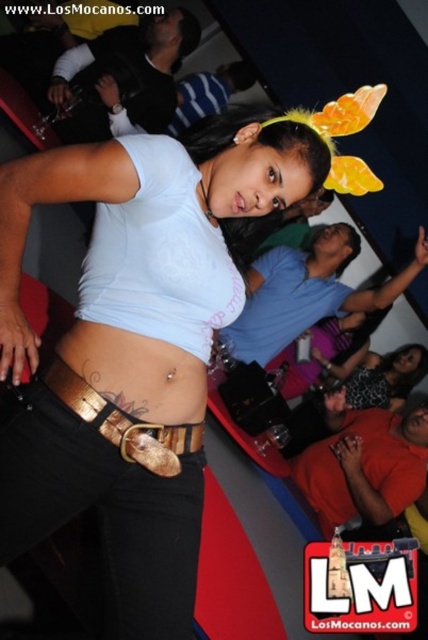
You are a photographer at the event and want to capture a shot focusing on the matte white tank top at center and the matte black top at center. Which one is positioned to the left side of the other?

The matte white tank top at center is to the left of the matte black top at center.

You are organizing a charity event and need to display two shirts, the matte white tank top at center and the matte black top at center, on a single mannequin. The mannequin can only accommodate one shirt at a time. Based on the image, which shirt would you choose to showcase first if you want to highlight the widest option?

The matte white tank top at center might be wider than the matte black top at center, so it should be showcased first to highlight its width.

You are a fashion designer observing this scene and want to create a new outfit that incorporates both the matte white tank top at center and the gold metallic belt at lower center. Based on their sizes, can the belt be worn with the tank top without appearing too small?

The matte white tank top at center is wider than the gold metallic belt at lower center. Since the tank top is wider, the belt can be worn with it without appearing too small as the belt will proportionally fit around the waist.